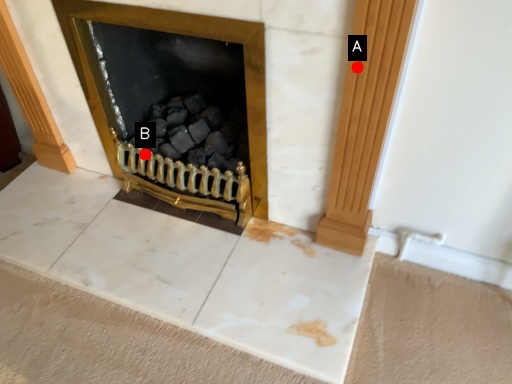
Question: Two points are circled on the image, labeled by A and B beside each circle. Which of the following is the farthest from the observer?

Choices:
 (A) A is further
 (B) B is further

Answer: (B)